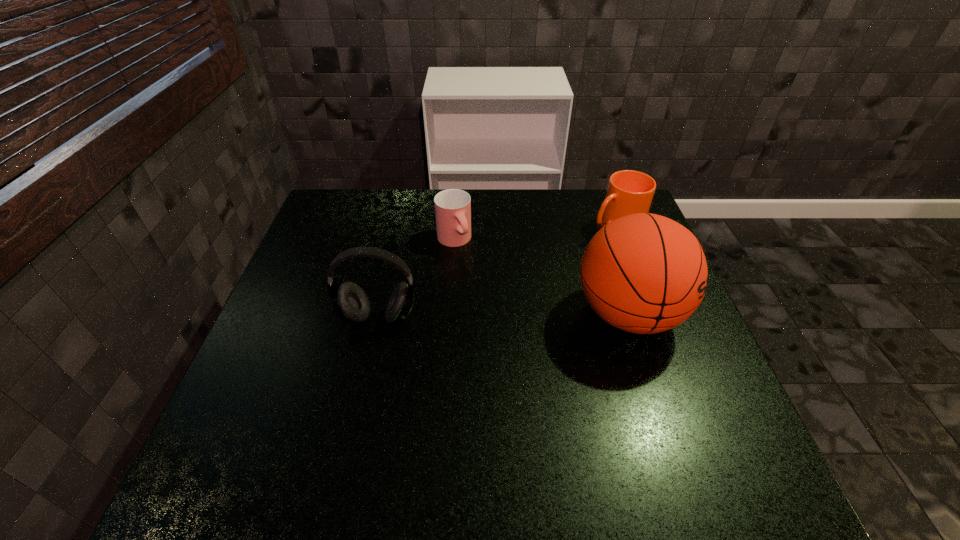
At what (x,y) coordinates should I click in order to perform the action: click on vacant space on the desktop that is between the leftmost object and the basketball and is positioned on the side of the cup with the handle. Please return your answer as a coordinate pair (x, y). Looking at the image, I should click on (502, 316).

Where is `vacant space on the desktop that is between the leftmost object and the basketball and is positioned on the handle side of the mug`? The image size is (960, 540). vacant space on the desktop that is between the leftmost object and the basketball and is positioned on the handle side of the mug is located at coordinates (469, 316).